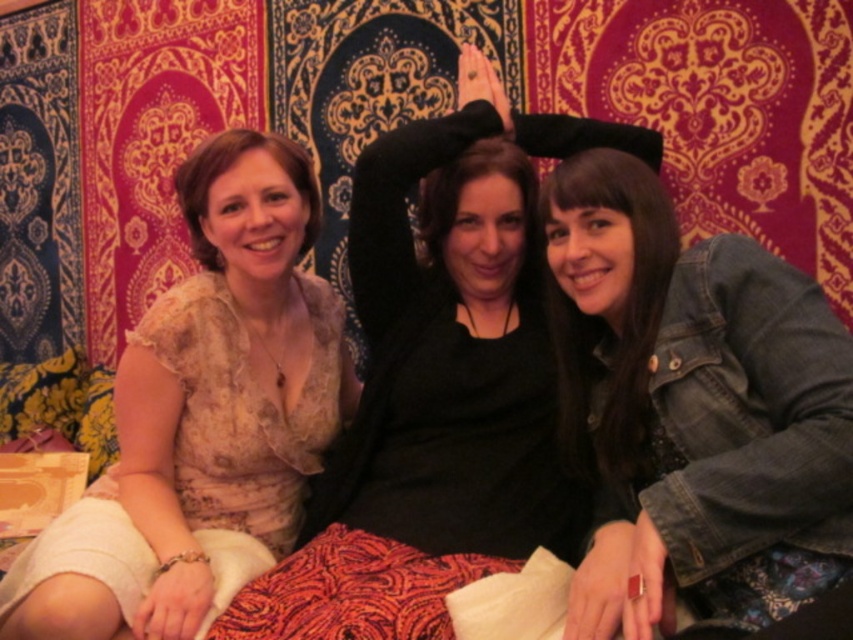
Can you confirm if denim jacket at center is thinner than matte beige blouse at left?

Yes, denim jacket at center is thinner than matte beige blouse at left.

Is the position of denim jacket at center more distant than that of matte beige blouse at left?

No, it is in front of matte beige blouse at left.

Locate an element on the screen. This screenshot has width=853, height=640. denim jacket at center is located at coordinates (689, 396).

The height and width of the screenshot is (640, 853). Find the location of `denim jacket at center`. denim jacket at center is located at coordinates (689, 396).